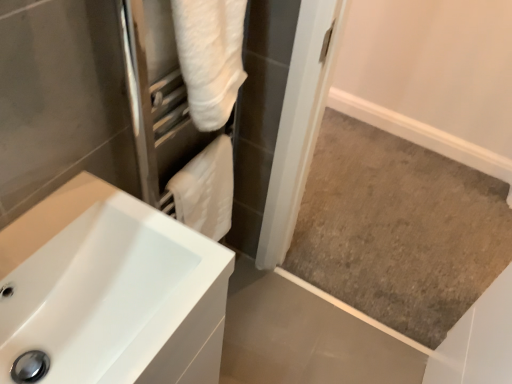
What do you see at coordinates (232, 110) in the screenshot? The image size is (512, 384). I see `white fluffy towel at upper center` at bounding box center [232, 110].

In order to face white soft towel at center, should I rotate leftwards or rightwards?

Rotate your view left by about 6.813°.

At what (x,y) coordinates should I click in order to perform the action: click on white glossy sink at lower left. Please return your answer as a coordinate pair (x, y). Looking at the image, I should click on (111, 290).

Where is `white fluffy towel at upper center`? white fluffy towel at upper center is located at coordinates (232, 110).

Looking at this image, considering the positions of objects white fluffy towel at upper center and white soft towel at center in the image provided, who is more to the right, white fluffy towel at upper center or white soft towel at center?

white fluffy towel at upper center.

I want to click on bath towel behind the white fluffy towel at upper center, so click(206, 189).

Which of these two, white fluffy towel at upper center or white soft towel at center, is smaller?

Smaller between the two is white soft towel at center.

Would you say white fluffy towel at upper center is inside or outside white soft towel at center?

white fluffy towel at upper center lies outside white soft towel at center.

Consider the image. Is white glossy sink at lower left turned away from white soft towel at center?

No, white glossy sink at lower left is not facing the opposite direction of white soft towel at center.

Can you tell me how much white glossy sink at lower left and white soft towel at center differ in facing direction?

The angle between the facing direction of white glossy sink at lower left and the facing direction of white soft towel at center is 1.89 degrees.

Is white glossy sink at lower left located outside white soft towel at center?

white glossy sink at lower left lies outside white soft towel at center's area.

From the image's perspective, between white glossy sink at lower left and white soft towel at center, who is located below?

white glossy sink at lower left is shown below in the image.

Which of these two, white soft towel at center or white glossy sink at lower left, is bigger?

white glossy sink at lower left.

From the image's perspective, is white soft towel at center above white glossy sink at lower left?

Correct, white soft towel at center appears higher than white glossy sink at lower left in the image.

Would you say white soft towel at center is inside or outside white glossy sink at lower left?

white soft towel at center is not inside white glossy sink at lower left, it's outside.

Does white soft towel at center lie behind white fluffy towel at upper center?

Yes, it is.

From a real-world perspective, is white soft towel at center on white fluffy towel at upper center?

Incorrect, from a real-world perspective, white soft towel at center is lower than white fluffy towel at upper center.

Between white soft towel at center and white fluffy towel at upper center, which one has smaller width?

Thinner between the two is white soft towel at center.

From the image's perspective, is white soft towel at center on top of white fluffy towel at upper center?

No, from the image's perspective, white soft towel at center is not on top of white fluffy towel at upper center.

Considering the relative positions of white fluffy towel at upper center and white glossy sink at lower left in the image provided, is white fluffy towel at upper center to the left or to the right of white glossy sink at lower left?

Clearly, white fluffy towel at upper center is on the right of white glossy sink at lower left in the image.

Is white fluffy towel at upper center shorter than white glossy sink at lower left?

Correct, white fluffy towel at upper center is not as tall as white glossy sink at lower left.

From a real-world perspective, is white fluffy towel at upper center above or below white glossy sink at lower left?

white fluffy towel at upper center is situated higher than white glossy sink at lower left in the real world.

Is white fluffy towel at upper center next to white glossy sink at lower left?

No.

Is white glossy sink at lower left directly adjacent to white fluffy towel at upper center?

white glossy sink at lower left is not next to white fluffy towel at upper center, and they're not touching.

Which object is wider, white glossy sink at lower left or white fluffy towel at upper center?

With larger width is white glossy sink at lower left.

Which of these two, white glossy sink at lower left or white fluffy towel at upper center, is bigger?

white glossy sink at lower left is bigger.

How many degrees apart are the facing directions of white glossy sink at lower left and white fluffy towel at upper center?

1.16 degrees.

You are a GUI agent. You are given a task and a screenshot of the screen. Output one action in this format:
    pyautogui.click(x=<x>, y=<y>)
    Task: Click on the bath towel lying below the white fluffy towel at upper center (from the image's perspective)
    This screenshot has width=512, height=384.
    Given the screenshot: What is the action you would take?
    pyautogui.click(x=206, y=189)

Image resolution: width=512 pixels, height=384 pixels. In order to click on bath towel above the white glossy sink at lower left (from the image's perspective) in this screenshot , I will do `click(206, 189)`.

Estimate the real-world distances between objects in this image. Which object is closer to white fluffy towel at upper center, white glossy sink at lower left or white soft towel at center?

white soft towel at center lies closer to white fluffy towel at upper center than the other object.

Considering their positions, is white glossy sink at lower left positioned closer to white soft towel at center than white fluffy towel at upper center?

white fluffy towel at upper center.

Which object lies nearer to the anchor point white glossy sink at lower left, white soft towel at center or white fluffy towel at upper center?

The object closer to white glossy sink at lower left is white soft towel at center.

Considering their positions, is white fluffy towel at upper center positioned closer to white soft towel at center than white glossy sink at lower left?

The object closer to white soft towel at center is white fluffy towel at upper center.

When comparing their distances from white fluffy towel at upper center, does white soft towel at center or white glossy sink at lower left seem further?

Among the two, white glossy sink at lower left is located further to white fluffy towel at upper center.

From the image, which object appears to be farther from white glossy sink at lower left, white fluffy towel at upper center or white soft towel at center?

white fluffy towel at upper center is positioned further to the anchor white glossy sink at lower left.

The width and height of the screenshot is (512, 384). I want to click on bath towel between white fluffy towel at upper center and white glossy sink at lower left vertically, so click(206, 189).